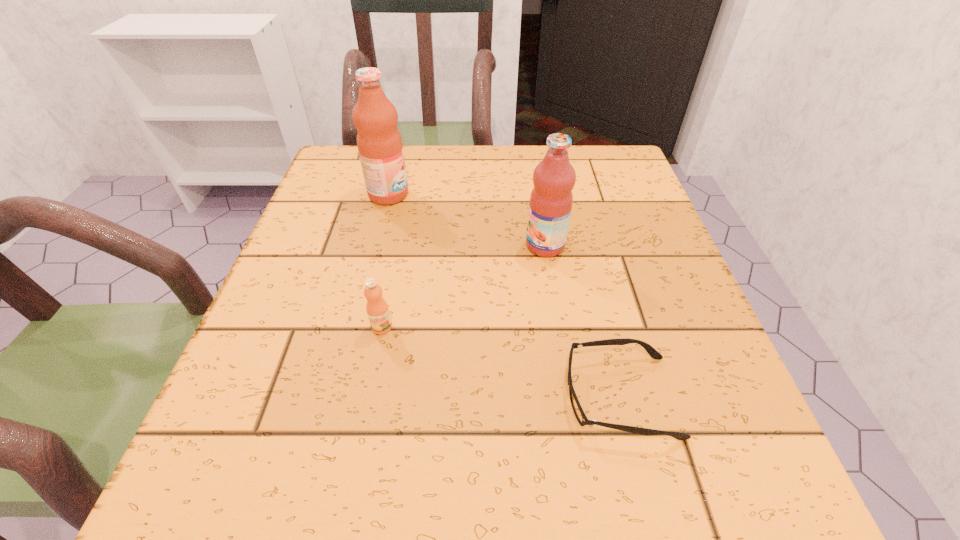
Locate an element on the screen. The width and height of the screenshot is (960, 540). vacant space that satisfies the following two spatial constraints: 1. on the front label of the right fruit juice; 2. on the front label of the third tallest object is located at coordinates (558, 327).